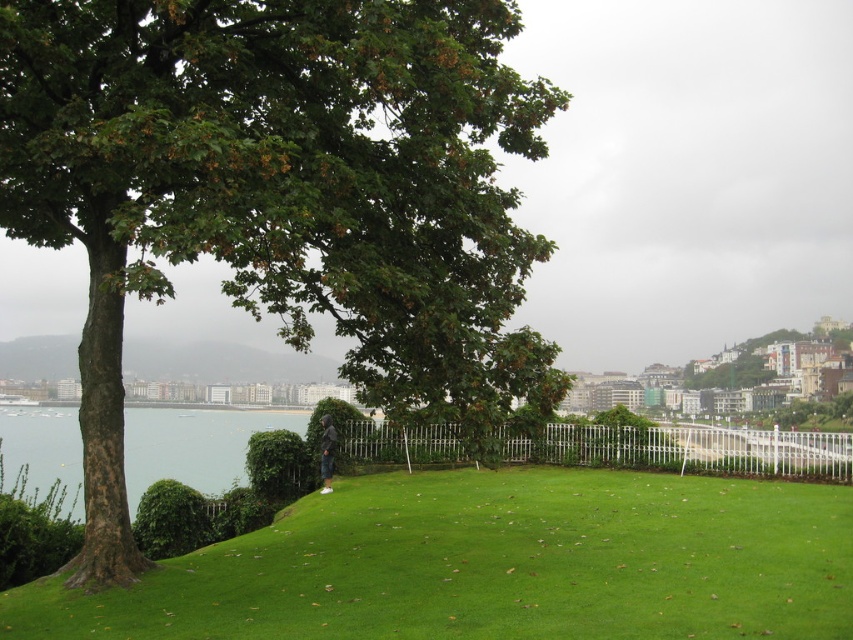
Question: Is green leafy tree at left wider than white metal fence at center?

Choices:
 (A) yes
 (B) no

Answer: (B)

Question: Does green leafy tree at left have a lesser width compared to white metal fence at center?

Choices:
 (A) yes
 (B) no

Answer: (A)

Question: Does green leafy tree at left have a larger size compared to white metal fence at center?

Choices:
 (A) no
 (B) yes

Answer: (B)

Question: Which point is farther to the camera?

Choices:
 (A) green leafy tree at left
 (B) white metal fence at center

Answer: (B)